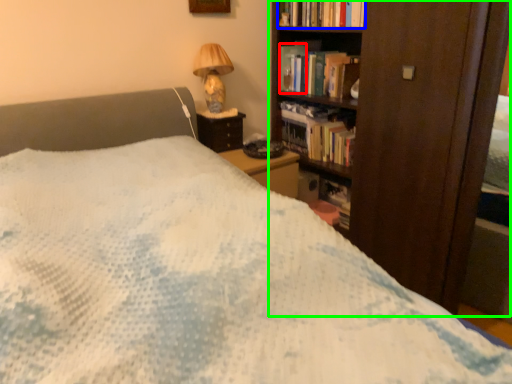
Question: Which object is the closest to the paperback book (highlighted by a red box)? Choose among these: book (highlighted by a blue box) or bookcase (highlighted by a green box).

Choices:
 (A) book
 (B) bookcase

Answer: (A)